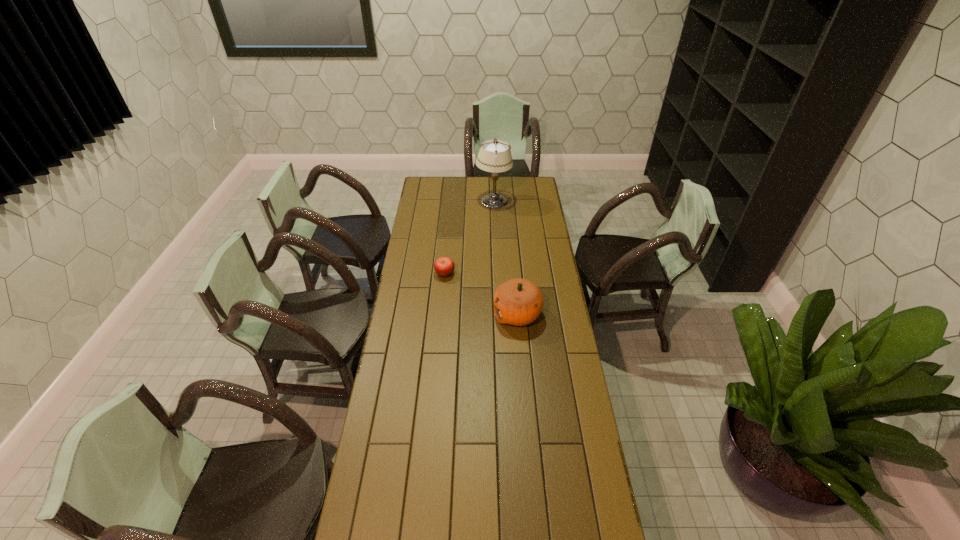
Find the location of a particular element. This screenshot has height=540, width=960. the tallest object is located at coordinates (494, 156).

This screenshot has width=960, height=540. I want to click on the farthest object, so click(x=494, y=156).

Locate an element on the screen. This screenshot has height=540, width=960. pumpkin is located at coordinates (518, 302).

Where is `the nearest object`? The image size is (960, 540). the nearest object is located at coordinates (518, 302).

This screenshot has height=540, width=960. I want to click on the shortest object, so click(444, 266).

The width and height of the screenshot is (960, 540). In order to click on apple in this screenshot , I will do `click(444, 266)`.

The width and height of the screenshot is (960, 540). I want to click on free location located 0.050m on the lampshade of the lampshade, so click(x=494, y=216).

Locate an element on the screen. vacant position located on the face of the second shortest object is located at coordinates (467, 314).

This screenshot has height=540, width=960. What are the coordinates of `free space located on the face of the second shortest object` in the screenshot? It's located at (449, 314).

Where is `free space located 0.390m on the face of the second shortest object`? Image resolution: width=960 pixels, height=540 pixels. free space located 0.390m on the face of the second shortest object is located at coordinates (407, 314).